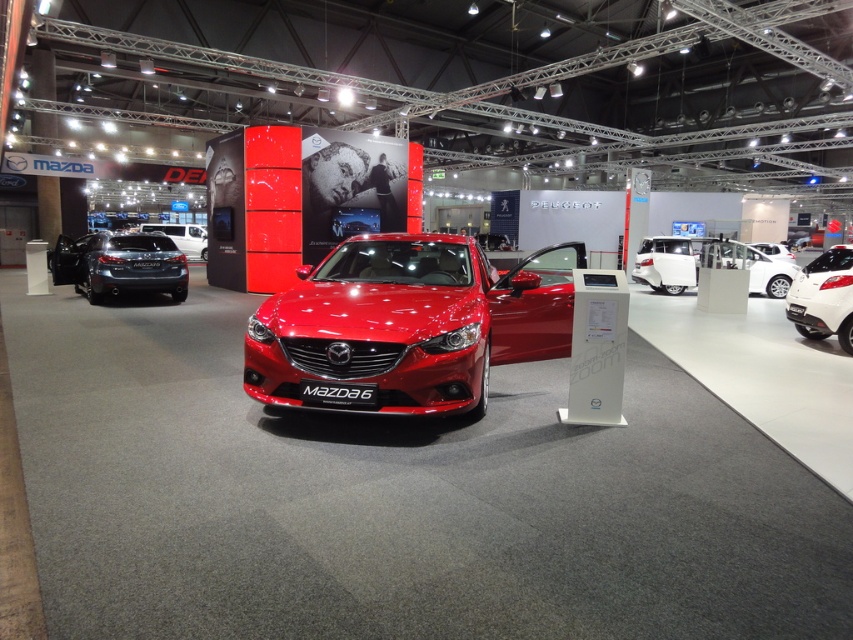
You are a photographer setting up a tripod to take a photo of both the matte black hatchback at left and the white glossy car at right. Which car should you position closer to the camera to ensure both appear equally tall in the photo?

The matte black hatchback at left is not as tall as the white glossy car at right. To make them appear equally tall in the photo, position the matte black hatchback at left closer to the camera than the white glossy car at right.

You are a photographer standing at the camera position in the exhibition hall. You want to take a closeup of the matte black hatchback at left without moving your position. Is it possible to do so with a standard camera lens that has a maximum zoom of 100mm?

The matte black hatchback at left is 36.48 feet away from camera. With a standard camera lens of 100mm, it is possible to capture a closeup of the matte black hatchback at left from this distance, as 100mm provides sufficient zoom for such a shot.

You are standing at the entrance of the Mazda exhibition hall and see the car at point [119,264]. Which Mazda vehicle is located at that point?

The matte black hatchback at left is located at point 0.411, 0.141.